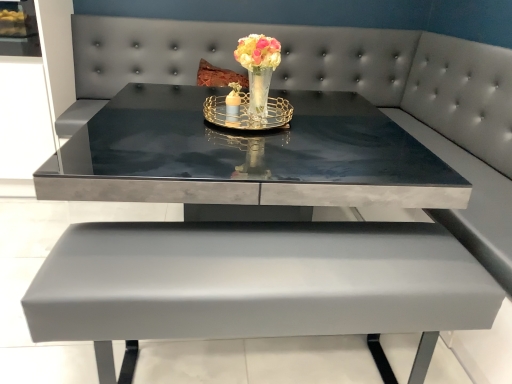
Locate an element on the screen. The height and width of the screenshot is (384, 512). vacant space to the right of glossy glass vase at center is located at coordinates (310, 126).